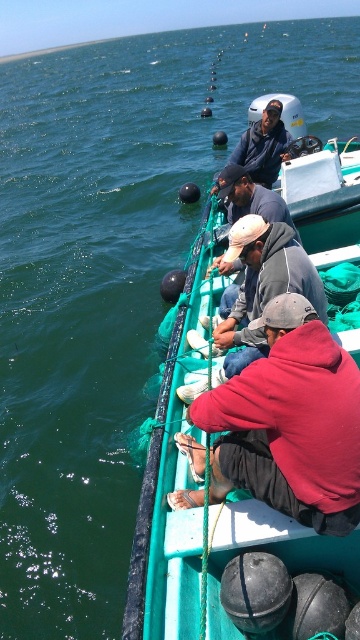
You are standing on the boat and want to hand a fishing rod to the person in the red hoodie at center. Where should you look to find them?

The red hoodie at center is located at point [290,422], so you should look towards that coordinate to find them.

You are standing on the dock and want to board the boat. You see two people on the boat wearing the gray hoodie at center and the dark blue fabric jacket at center. Which one is closer to the left side of the boat?

The gray hoodie at center is closer to the left side of the boat because it is positioned to the left of the dark blue fabric jacket at center.

You are a photographer taking a picture of the red hoodie at center and the gray hoodie at center. Which person should you adjust to be in focus if the camera can only focus on one person at a time?

The red hoodie at center is much taller than the gray hoodie at center, so you should focus on the red hoodie at center to ensure it is in focus.